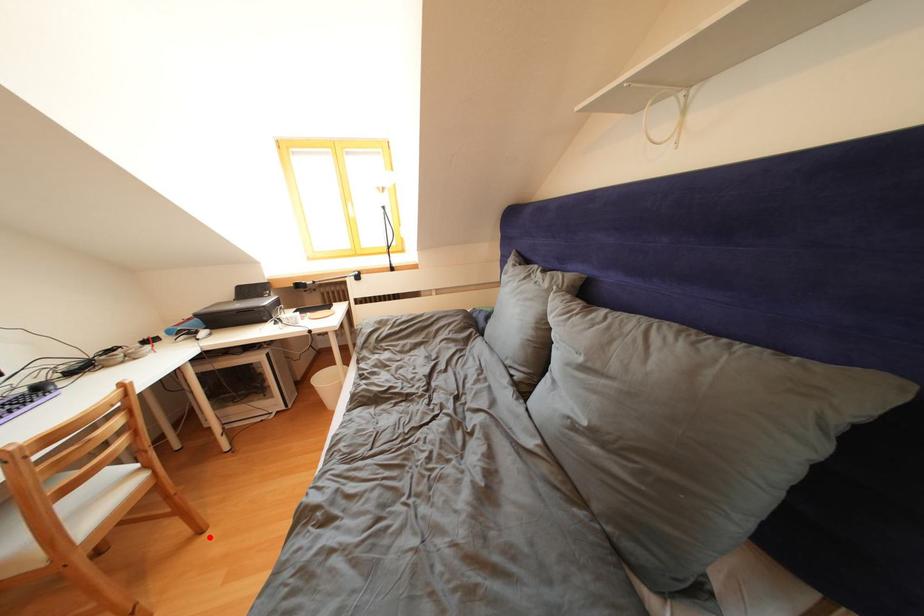
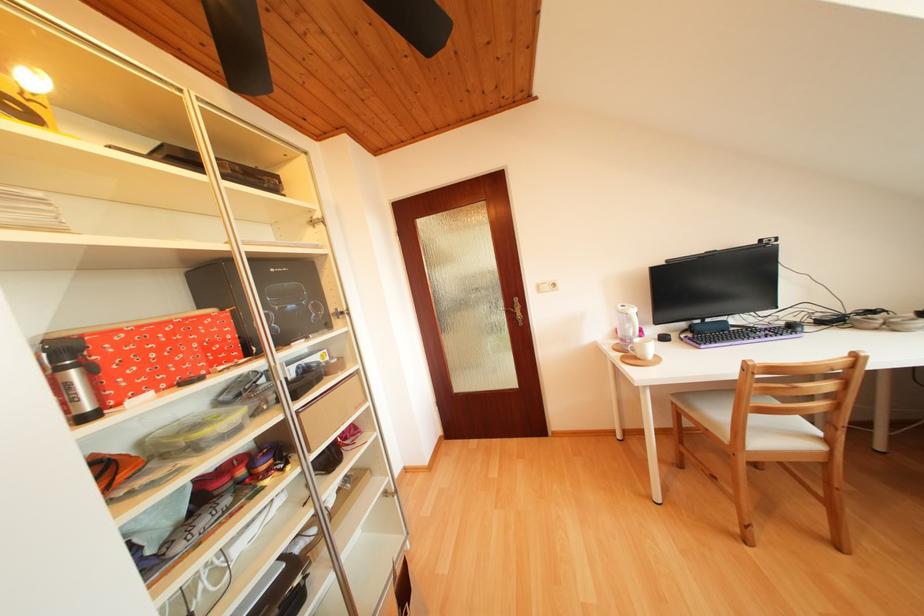
Locate, in the second image, the point that corresponds to the highlighted location in the first image.

(847, 553)